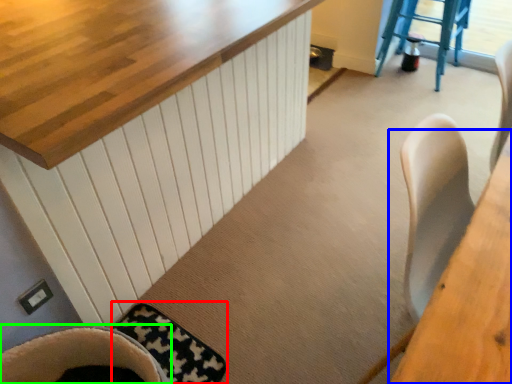
Question: Estimate the real-world distances between objects in this image. Which object is farther from mat (highlighted by a red box), table (highlighted by a blue box) or chair (highlighted by a green box)?

Choices:
 (A) table
 (B) chair

Answer: (A)